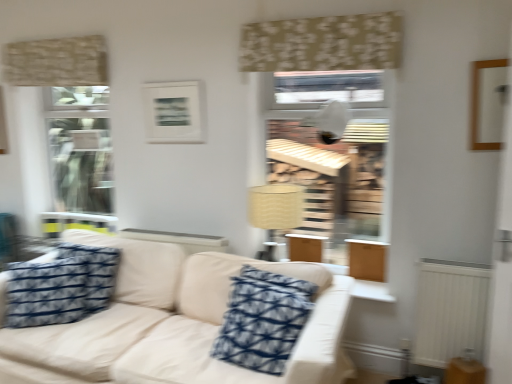
Question: Could blue printed fabric pillow at left, acting as the second pillow starting from the right, be considered to be inside beige fabric couch at center?

Choices:
 (A) yes
 (B) no

Answer: (A)

Question: Is beige fabric couch at center bigger than blue printed fabric pillow at left, acting as the second pillow starting from the right?

Choices:
 (A) no
 (B) yes

Answer: (B)

Question: Can you confirm if beige fabric couch at center is smaller than blue printed fabric pillow at left, which is counted as the 1th pillow, starting from the left?

Choices:
 (A) no
 (B) yes

Answer: (A)

Question: Is beige fabric couch at center at the left side of blue printed fabric pillow at left, which is counted as the 1th pillow, starting from the left?

Choices:
 (A) no
 (B) yes

Answer: (A)

Question: Is beige fabric couch at center beside blue printed fabric pillow at left, which is counted as the 1th pillow, starting from the left?

Choices:
 (A) no
 (B) yes

Answer: (A)

Question: From the image's perspective, is beige fabric couch at center located beneath blue printed fabric pillow at left, acting as the second pillow starting from the right?

Choices:
 (A) yes
 (B) no

Answer: (A)

Question: Does beige floral fabric at upper center, which is the 2th curtain in back-to-front order, touch beige textured curtain at upper left, acting as the first curtain starting from the left?

Choices:
 (A) yes
 (B) no

Answer: (B)

Question: Could you tell me if beige floral fabric at upper center, which appears as the 1th curtain when viewed from the front, is turned towards beige textured curtain at upper left, acting as the first curtain starting from the back?

Choices:
 (A) no
 (B) yes

Answer: (A)

Question: From the image's perspective, is beige floral fabric at upper center, which appears as the 1th curtain when viewed from the front, on beige textured curtain at upper left, positioned as the 2th curtain in front-to-back order?

Choices:
 (A) yes
 (B) no

Answer: (B)

Question: From a real-world perspective, is beige floral fabric at upper center, which is the first curtain in right-to-left order, positioned under beige textured curtain at upper left, arranged as the second curtain when viewed from the right, based on gravity?

Choices:
 (A) no
 (B) yes

Answer: (A)

Question: Is there a large distance between beige floral fabric at upper center, which is the 2th curtain in left-to-right order, and beige textured curtain at upper left, positioned as the 2th curtain in front-to-back order?

Choices:
 (A) no
 (B) yes

Answer: (B)

Question: Is beige floral fabric at upper center, which is the first curtain in right-to-left order, closer to camera compared to beige textured curtain at upper left, arranged as the second curtain when viewed from the right?

Choices:
 (A) no
 (B) yes

Answer: (B)

Question: Does beige textured curtain at upper left, arranged as the second curtain when viewed from the right, have a smaller size compared to beige fabric lampshade at center?

Choices:
 (A) no
 (B) yes

Answer: (B)